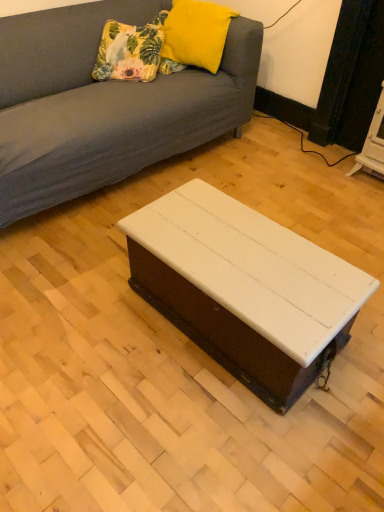
Question: From a real-world perspective, is white painted wood coffee table at center above or below yellow fuzzy pillow at upper center, marked as the first pillow in a right-to-left arrangement?

Choices:
 (A) below
 (B) above

Answer: (A)

Question: Is white painted wood coffee table at center situated inside yellow fuzzy pillow at upper center, marked as the first pillow in a right-to-left arrangement, or outside?

Choices:
 (A) inside
 (B) outside

Answer: (B)

Question: Which of these objects is positioned farthest from the white painted wood coffee table at center?

Choices:
 (A) yellow fuzzy pillow at upper center, marked as the first pillow in a right-to-left arrangement
 (B) floral fabric cushion at upper left, the 1th pillow when ordered from left to right

Answer: (A)

Question: Which object is positioned farthest from the yellow fuzzy pillow at upper center, which appears as the second pillow when viewed from the left?

Choices:
 (A) floral fabric cushion at upper left, arranged as the second pillow when viewed from the right
 (B) white painted wood coffee table at center

Answer: (B)